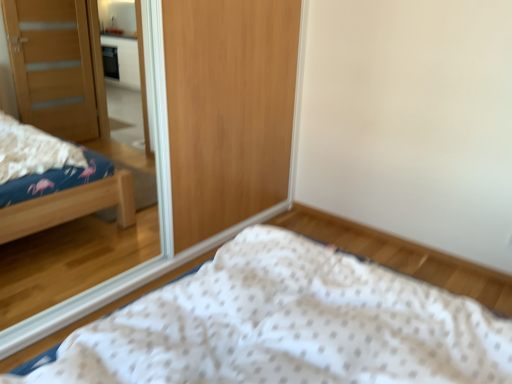
In order to click on wooden mirror at upper left in this screenshot , I will do `click(158, 211)`.

Describe the element at coordinates (158, 211) in the screenshot. I see `wooden mirror at upper left` at that location.

Measure the distance between point (164, 150) and camera.

Point (164, 150) and camera are 7.39 feet apart.

This screenshot has height=384, width=512. I want to click on white dotted fabric at lower center, so click(289, 325).

The width and height of the screenshot is (512, 384). What do you see at coordinates (289, 325) in the screenshot? I see `white dotted fabric at lower center` at bounding box center [289, 325].

This screenshot has width=512, height=384. In order to click on wooden mirror at upper left in this screenshot , I will do `click(158, 211)`.

Considering the positions of objects white dotted fabric at lower center and wooden mirror at upper left in the image provided, who is more to the left, white dotted fabric at lower center or wooden mirror at upper left?

wooden mirror at upper left.

Considering their positions, is white dotted fabric at lower center located in front of or behind wooden mirror at upper left?

Clearly, white dotted fabric at lower center is in front of wooden mirror at upper left.

Is point (194, 328) farther from camera compared to point (159, 273)?

No, it is not.

From the image's perspective, is white dotted fabric at lower center above wooden mirror at upper left?

No.

From a real-world perspective, which object stands above the other?

In real-world perspective, wooden mirror at upper left is above.

Can you confirm if white dotted fabric at lower center is thinner than wooden mirror at upper left?

Incorrect, the width of white dotted fabric at lower center is not less than that of wooden mirror at upper left.

Based on the photo, considering the sizes of objects white dotted fabric at lower center and wooden mirror at upper left in the image provided, who is taller, white dotted fabric at lower center or wooden mirror at upper left?

With more height is wooden mirror at upper left.

Considering the sizes of objects white dotted fabric at lower center and wooden mirror at upper left in the image provided, who is smaller, white dotted fabric at lower center or wooden mirror at upper left?

Smaller between the two is wooden mirror at upper left.

Is wooden mirror at upper left a part of white dotted fabric at lower center?

Actually, wooden mirror at upper left is outside white dotted fabric at lower center.

Would you consider white dotted fabric at lower center to be distant from wooden mirror at upper left?

That's right, there is a large distance between white dotted fabric at lower center and wooden mirror at upper left.

Is white dotted fabric at lower center facing away from wooden mirror at upper left?

white dotted fabric at lower center does not have its back to wooden mirror at upper left.

Based on the photo, what's the angular difference between white dotted fabric at lower center and wooden mirror at upper left's facing directions?

They differ by 179 degrees in their facing directions.

Identify the location of bed on the right of wooden mirror at upper left. The width and height of the screenshot is (512, 384). (289, 325).

In the scene shown: Which is more to the right, wooden mirror at upper left or white dotted fabric at lower center?

Positioned to the right is white dotted fabric at lower center.

Is wooden mirror at upper left further to camera compared to white dotted fabric at lower center?

Yes, wooden mirror at upper left is further from the camera.

Which is closer, (157, 0) or (404, 347)?

Point (157, 0) is positioned farther from the camera compared to point (404, 347).

From the image's perspective, would you say wooden mirror at upper left is shown under white dotted fabric at lower center?

No, from the image's perspective, wooden mirror at upper left is not below white dotted fabric at lower center.

From a real-world perspective, between wooden mirror at upper left and white dotted fabric at lower center, who is vertically higher?

In real-world perspective, wooden mirror at upper left is above.

Considering the sizes of objects wooden mirror at upper left and white dotted fabric at lower center in the image provided, who is thinner, wooden mirror at upper left or white dotted fabric at lower center?

Thinner between the two is wooden mirror at upper left.

Is wooden mirror at upper left taller or shorter than white dotted fabric at lower center?

Clearly, wooden mirror at upper left is taller compared to white dotted fabric at lower center.

Considering the sizes of objects wooden mirror at upper left and white dotted fabric at lower center in the image provided, who is smaller, wooden mirror at upper left or white dotted fabric at lower center?

wooden mirror at upper left.

Is wooden mirror at upper left not inside white dotted fabric at lower center?

Indeed, wooden mirror at upper left is completely outside white dotted fabric at lower center.

Would you consider wooden mirror at upper left to be distant from white dotted fabric at lower center?

Yes, wooden mirror at upper left and white dotted fabric at lower center are located far from each other.

Is wooden mirror at upper left aimed at white dotted fabric at lower center?

Yes, wooden mirror at upper left is oriented towards white dotted fabric at lower center.

Locate an element on the screen. bed that is under the wooden mirror at upper left (from a real-world perspective) is located at coordinates (289, 325).

Find the location of `mirror located on the left of white dotted fabric at lower center`. mirror located on the left of white dotted fabric at lower center is located at coordinates (158, 211).

This screenshot has width=512, height=384. I want to click on bed on the right of wooden mirror at upper left, so click(x=289, y=325).